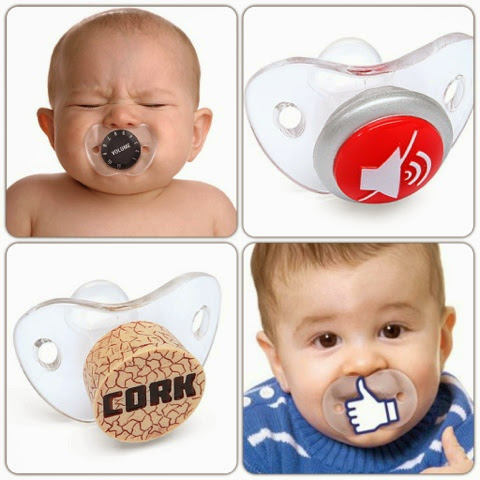
Where is `cork`? cork is located at coordinates (152, 374).